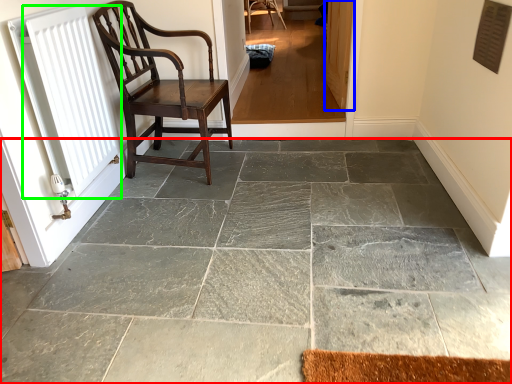
Question: Which object is the closest to the concrete (highlighted by a red box)? Choose among these: screen door (highlighted by a blue box) or radiator (highlighted by a green box).

Choices:
 (A) screen door
 (B) radiator

Answer: (B)